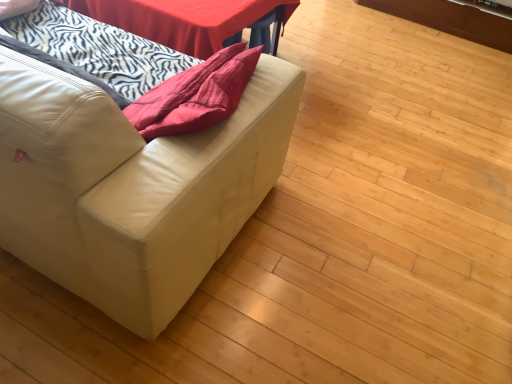
Question: Is white leather couch at left turned away from white zebra-patterned blanket at left?

Choices:
 (A) yes
 (B) no

Answer: (A)

Question: Is white leather couch at left wider than white zebra-patterned blanket at left?

Choices:
 (A) yes
 (B) no

Answer: (A)

Question: Is white leather couch at left not near white zebra-patterned blanket at left?

Choices:
 (A) yes
 (B) no

Answer: (B)

Question: Considering the relative positions of white leather couch at left and white zebra-patterned blanket at left in the image provided, is white leather couch at left to the left of white zebra-patterned blanket at left from the viewer's perspective?

Choices:
 (A) no
 (B) yes

Answer: (B)

Question: Considering the relative sizes of white leather couch at left and white zebra-patterned blanket at left in the image provided, is white leather couch at left shorter than white zebra-patterned blanket at left?

Choices:
 (A) no
 (B) yes

Answer: (A)

Question: Could white zebra-patterned blanket at left be considered to be inside white leather couch at left?

Choices:
 (A) yes
 (B) no

Answer: (A)

Question: Is white zebra-patterned blanket at left far away from smooth red table at upper center?

Choices:
 (A) yes
 (B) no

Answer: (B)

Question: Considering the relative sizes of white zebra-patterned blanket at left and smooth red table at upper center in the image provided, is white zebra-patterned blanket at left taller than smooth red table at upper center?

Choices:
 (A) no
 (B) yes

Answer: (B)

Question: Considering the relative sizes of white zebra-patterned blanket at left and smooth red table at upper center in the image provided, is white zebra-patterned blanket at left shorter than smooth red table at upper center?

Choices:
 (A) no
 (B) yes

Answer: (A)

Question: Is white zebra-patterned blanket at left directly adjacent to smooth red table at upper center?

Choices:
 (A) yes
 (B) no

Answer: (B)

Question: From the image's perspective, is white zebra-patterned blanket at left under smooth red table at upper center?

Choices:
 (A) yes
 (B) no

Answer: (A)

Question: From a real-world perspective, is white zebra-patterned blanket at left located higher than smooth red table at upper center?

Choices:
 (A) no
 (B) yes

Answer: (B)

Question: Are smooth red table at upper center and white zebra-patterned blanket at left located far from each other?

Choices:
 (A) no
 (B) yes

Answer: (A)